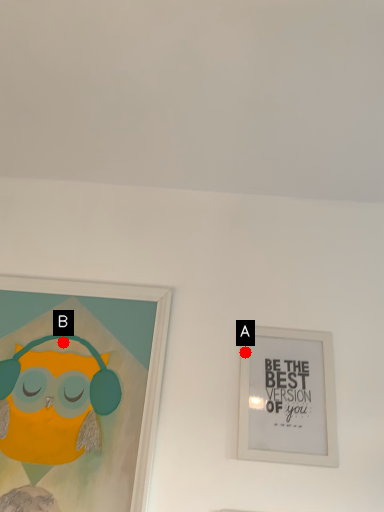
Question: Two points are circled on the image, labeled by A and B beside each circle. Which point is closer to the camera?

Choices:
 (A) A is closer
 (B) B is closer

Answer: (A)